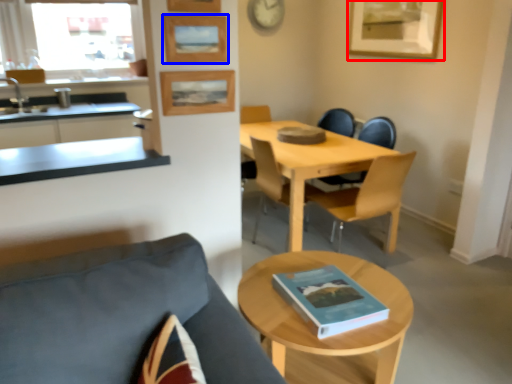
Question: Which object is further to the camera taking this photo, picture frame (highlighted by a red box) or picture frame (highlighted by a blue box)?

Choices:
 (A) picture frame
 (B) picture frame

Answer: (A)